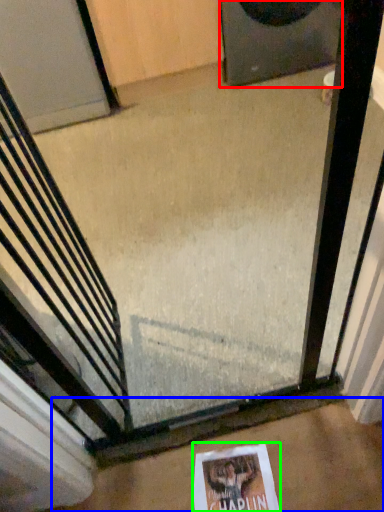
Question: Which is nearer to the speaker (highlighted by a red box)? concrete (highlighted by a blue box) or flyer (highlighted by a green box).

Choices:
 (A) concrete
 (B) flyer

Answer: (A)